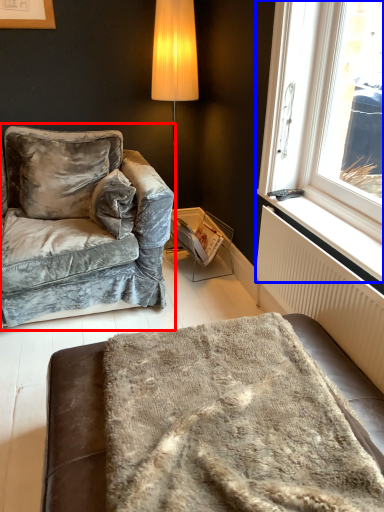
Question: Which of the following is the farthest to the observer, studio couch (highlighted by a red box) or window (highlighted by a blue box)?

Choices:
 (A) studio couch
 (B) window

Answer: (A)